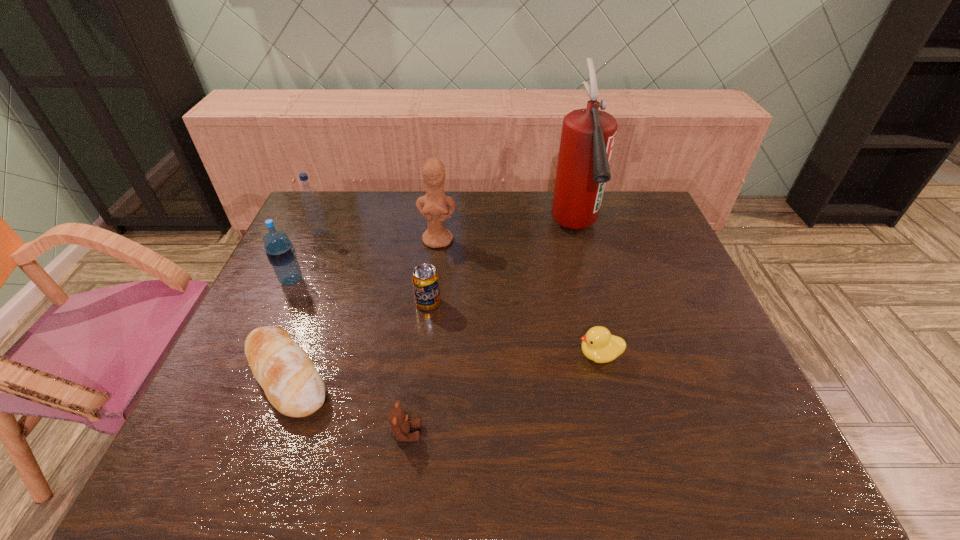
The image size is (960, 540). I want to click on free space located 0.350m on the front-facing side of the seventh shortest object, so click(427, 338).

The height and width of the screenshot is (540, 960). What are the coordinates of `free location located 0.090m on the right of the farther water bottle` in the screenshot? It's located at (356, 233).

Image resolution: width=960 pixels, height=540 pixels. Find the location of `vacant space located on the back of the fourth farthest object`. vacant space located on the back of the fourth farthest object is located at coordinates (315, 229).

This screenshot has height=540, width=960. I want to click on vacant space located 0.080m on the left of the soda can, so click(x=386, y=303).

Image resolution: width=960 pixels, height=540 pixels. Find the location of `vacant space located on the beak of the duckling`. vacant space located on the beak of the duckling is located at coordinates (507, 355).

I want to click on vacant space situated 0.160m on the beak of the duckling, so click(x=512, y=355).

Image resolution: width=960 pixels, height=540 pixels. In order to click on vacant region located 0.160m on the beak of the duckling in this screenshot , I will do `click(512, 355)`.

The height and width of the screenshot is (540, 960). In order to click on free region located on the front of the bread in this screenshot , I will do `click(260, 445)`.

The width and height of the screenshot is (960, 540). In order to click on vacant area located 0.050m on the face of the teddy bear in this screenshot , I will do `click(444, 433)`.

This screenshot has width=960, height=540. Find the location of `fire extinguisher that is positioned at the far edge`. fire extinguisher that is positioned at the far edge is located at coordinates (588, 135).